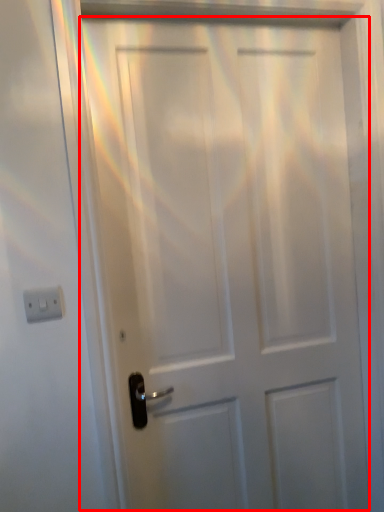
Question: In this image, where is door (annotated by the red box) located relative to light switch?

Choices:
 (A) right
 (B) left

Answer: (A)